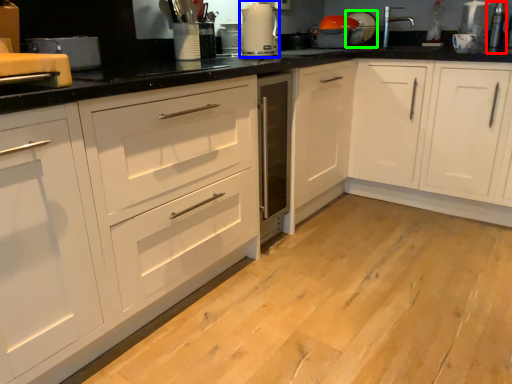
Question: Which object is the closest to the appliance (highlighted by a red box)? Choose among these: kitchen appliance (highlighted by a blue box) or appliance (highlighted by a green box).

Choices:
 (A) kitchen appliance
 (B) appliance

Answer: (B)